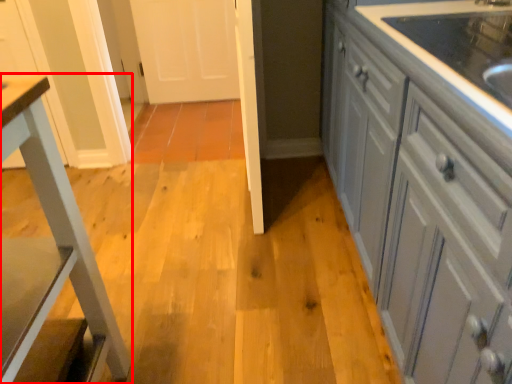
Question: From the image, what is the correct spatial relationship of furniture (annotated by the red box) in relation to cabinetry?

Choices:
 (A) left
 (B) right

Answer: (A)